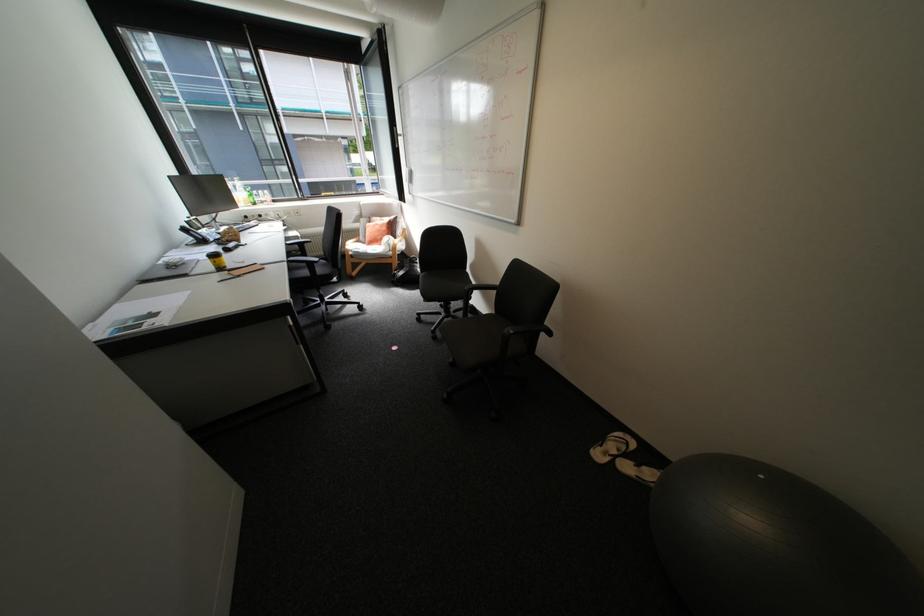
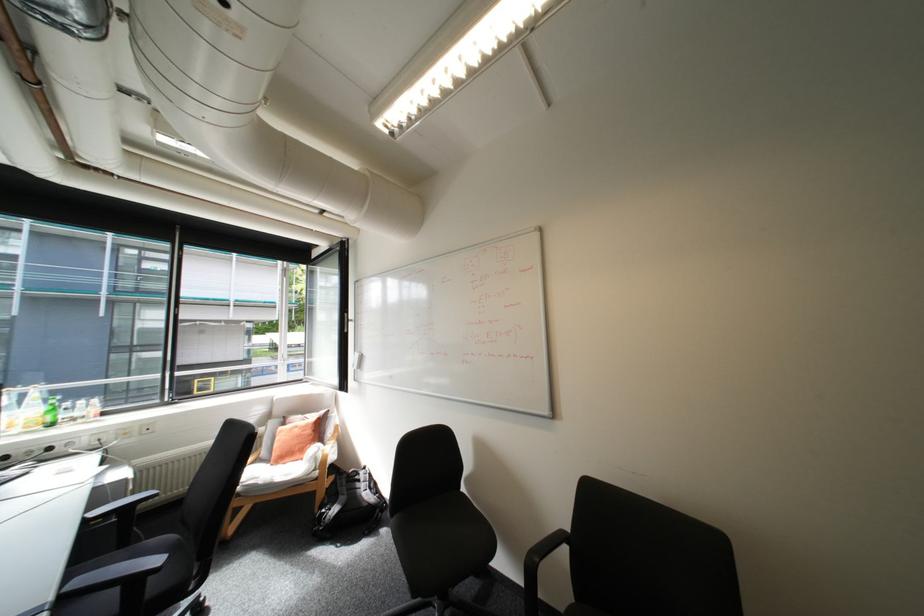
The point at (295, 259) is marked in the first image. Where is the corresponding point in the second image?

(61, 598)